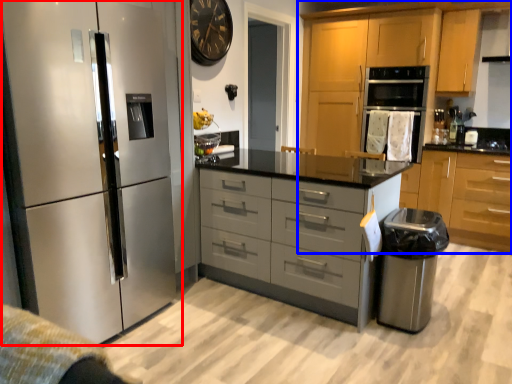
Question: Which object appears farthest to the camera in this image, refrigerator (highlighted by a red box) or cabinetry (highlighted by a blue box)?

Choices:
 (A) refrigerator
 (B) cabinetry

Answer: (B)